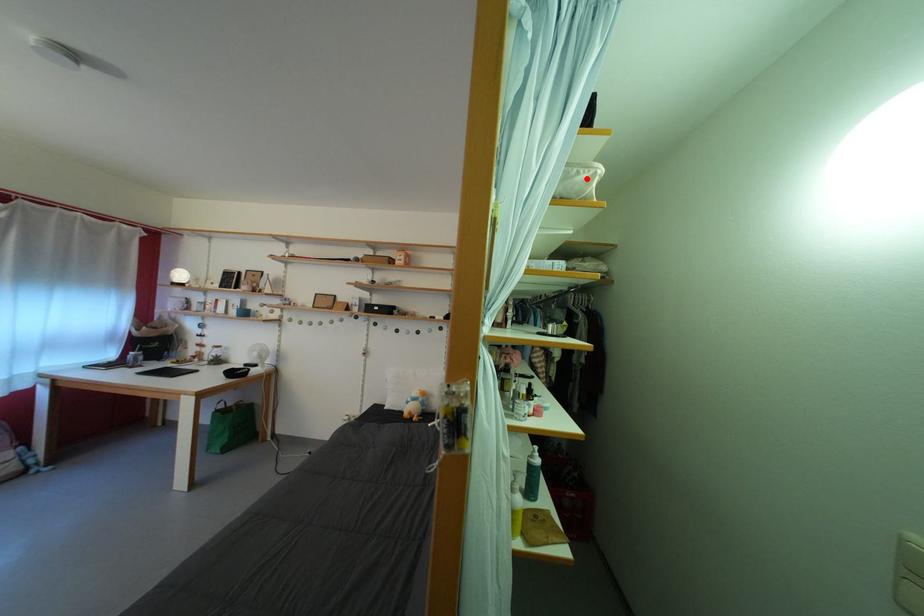
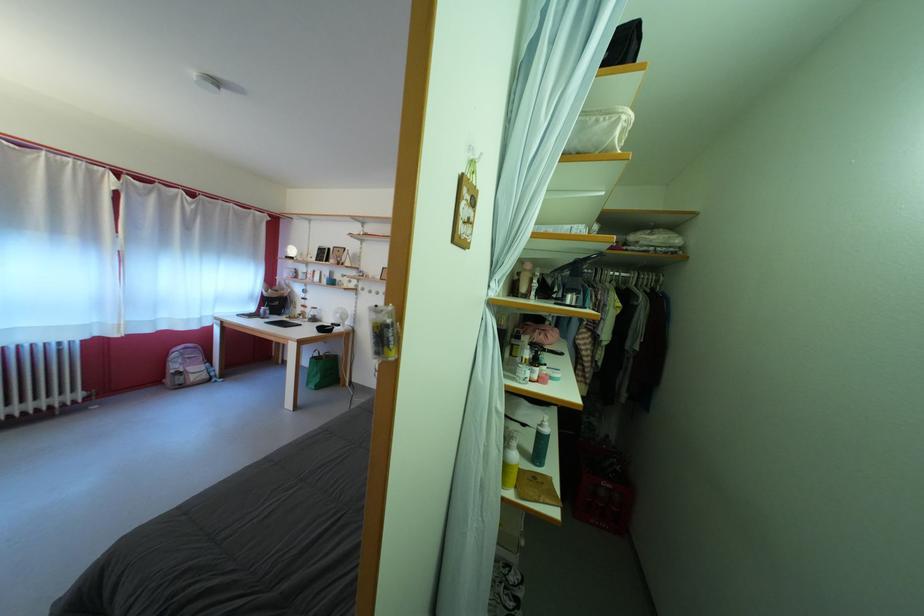
The point at the highlighted location is marked in the first image. Where is the corresponding point in the second image?

(605, 128)